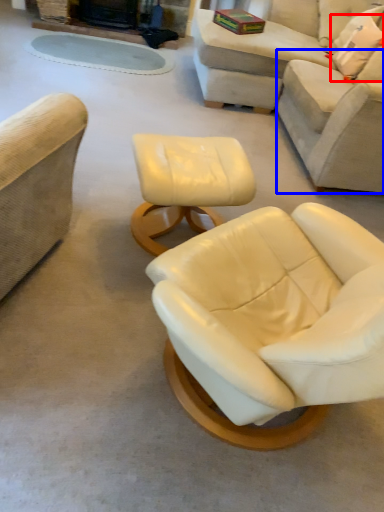
Question: Which point is closer to the camera, pillow (highlighted by a red box) or couch (highlighted by a blue box)?

Choices:
 (A) pillow
 (B) couch

Answer: (B)